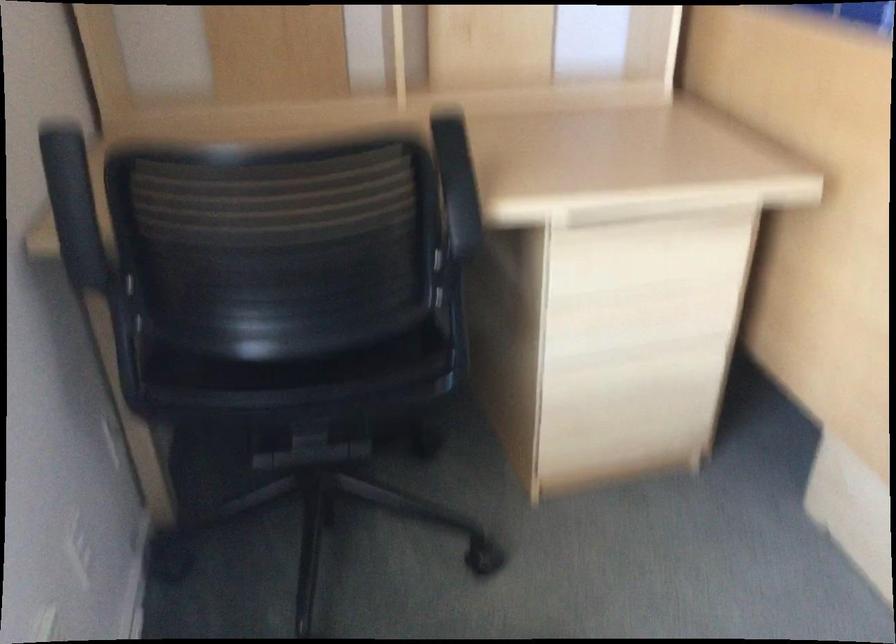
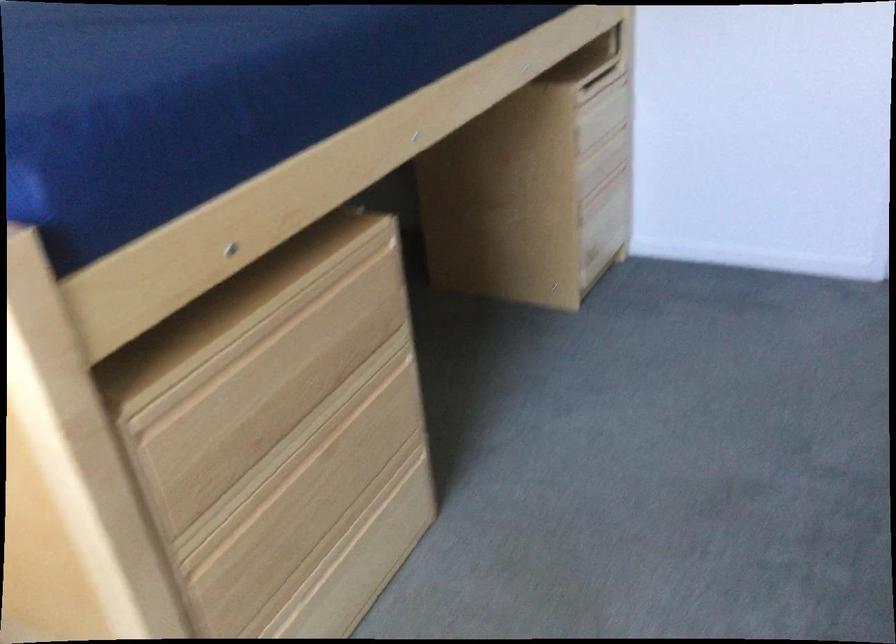
Question: The first image is from the beginning of the video and the second image is from the end. How did the camera likely rotate when shooting the video?

Choices:
 (A) Left
 (B) Right
 (C) Up
 (D) Down

Answer: (B)